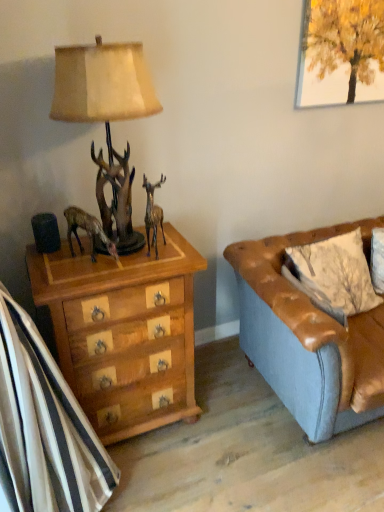
This screenshot has height=512, width=384. What are the coordinates of `vacant space to the left of metallic gold reindeer at center` in the screenshot? It's located at (117, 259).